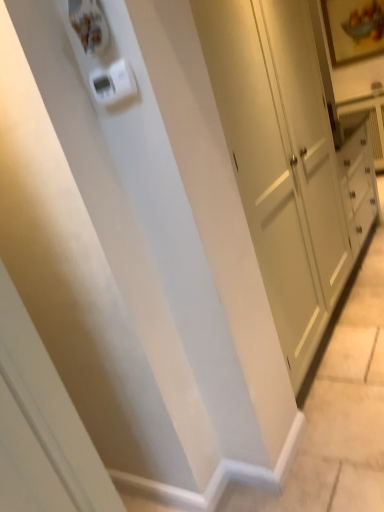
Question: In terms of height, does white plastic light switch at upper center look taller or shorter compared to white glossy screen door at lower left?

Choices:
 (A) tall
 (B) short

Answer: (B)

Question: In the image, is white plastic light switch at upper center on the left side or the right side of white glossy screen door at lower left?

Choices:
 (A) right
 (B) left

Answer: (A)

Question: Looking at their shapes, would you say white plastic light switch at upper center is wider or thinner than white glossy screen door at lower left?

Choices:
 (A) thin
 (B) wide

Answer: (A)

Question: In the image, is white glossy screen door at lower left positioned in front of or behind white plastic light switch at upper center?

Choices:
 (A) behind
 (B) front

Answer: (B)

Question: Does point (18, 325) appear closer or farther from the camera than point (124, 89)?

Choices:
 (A) closer
 (B) farther

Answer: (A)

Question: From their relative heights in the image, would you say white glossy screen door at lower left is taller or shorter than white plastic light switch at upper center?

Choices:
 (A) tall
 (B) short

Answer: (A)

Question: Choose the correct answer: Is white glossy screen door at lower left inside white plastic light switch at upper center or outside it?

Choices:
 (A) outside
 (B) inside

Answer: (A)